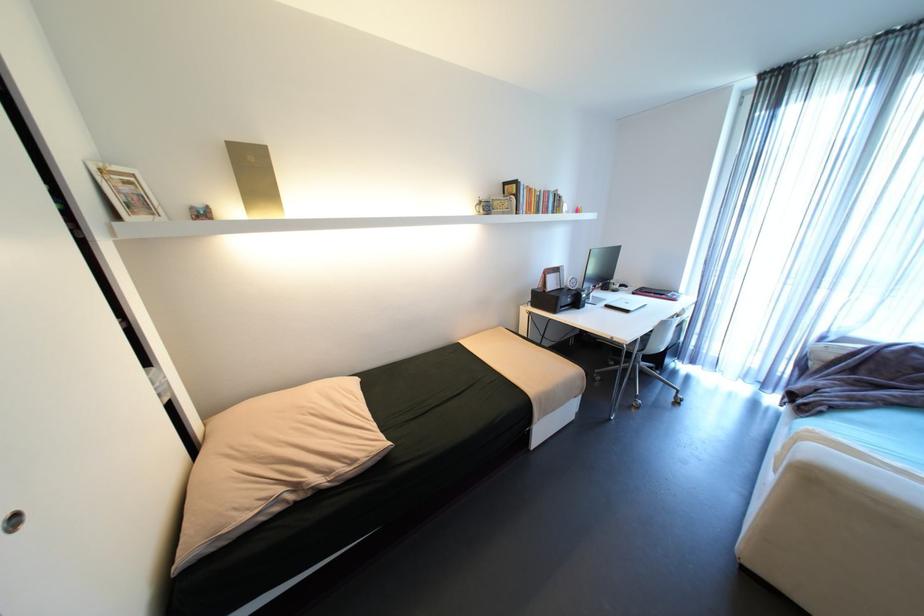
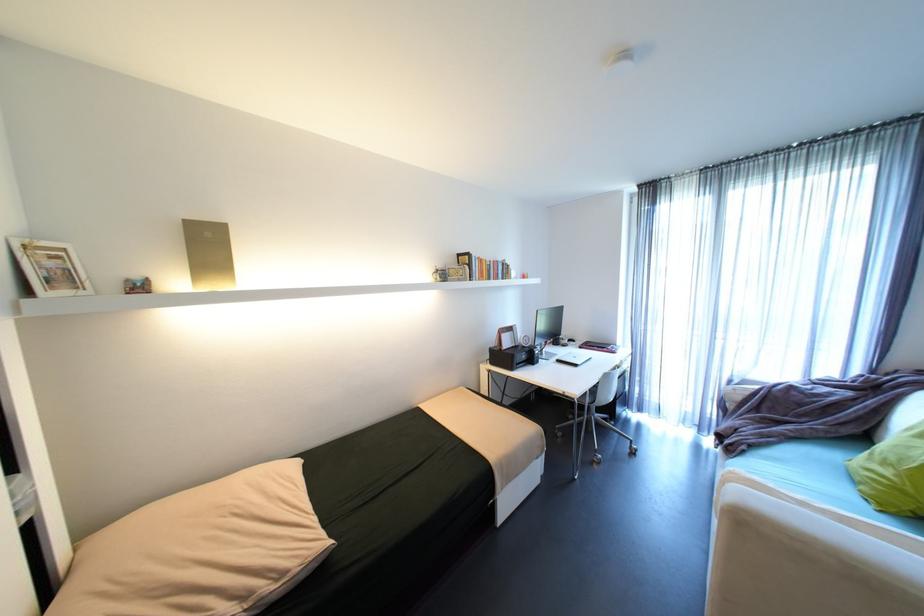
Where in the second image is the point corresponding to the point at 610,308 from the first image?

(562, 363)